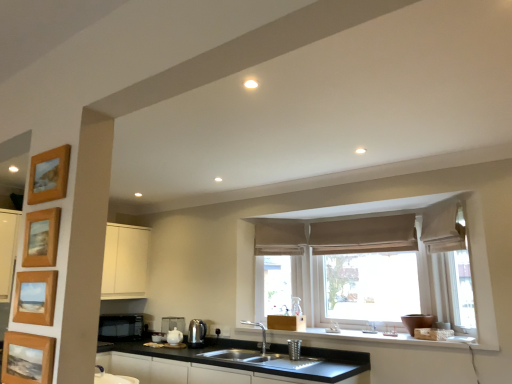
This screenshot has height=384, width=512. I want to click on free space above beige fabric curtain at upper right, marked as the 3th curtain in a left-to-right arrangement (from a real-world perspective), so click(x=434, y=205).